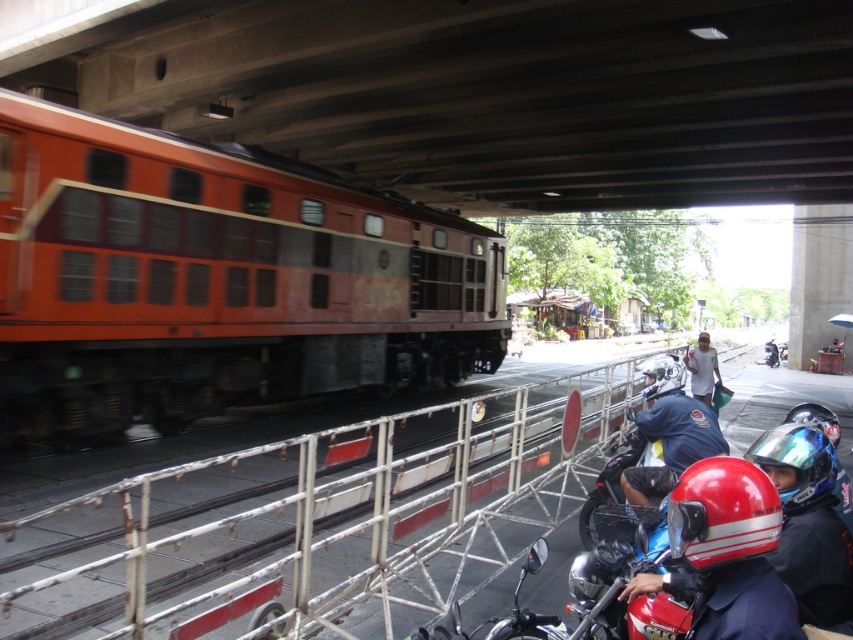
Question: Which of the following is the closest to the observer?

Choices:
 (A) shiny red helmet at lower right
 (B) red glossy motorcycle at lower right

Answer: (A)

Question: Is orange matte train at left above shiny red helmet at lower right?

Choices:
 (A) yes
 (B) no

Answer: (A)

Question: Among these objects, which one is farthest from the camera?

Choices:
 (A) orange matte train at left
 (B) red glossy motorcycle at lower right
 (C) shiny red helmet at lower right
 (D) shiny blue helmet at center

Answer: (A)

Question: Is orange matte train at left positioned in front of white matte shirt at right?

Choices:
 (A) no
 (B) yes

Answer: (B)

Question: Which object is positioned farthest from the white matte shirt at right?

Choices:
 (A) shiny blue helmet at center
 (B) red glossy motorcycle at lower right
 (C) orange matte train at left
 (D) shiny red helmet at lower right

Answer: (D)

Question: Can you confirm if shiny red helmet at lower right is positioned to the right of white matte shirt at right?

Choices:
 (A) no
 (B) yes

Answer: (A)